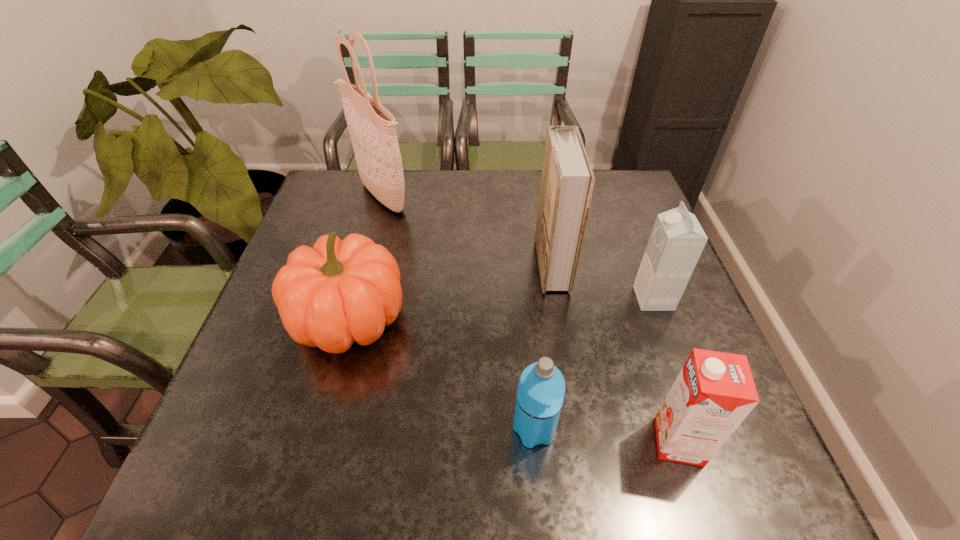
Find the location of a particular element. object that is the third nearest to the nearer carton is located at coordinates tap(567, 181).

Point out which object is positioned as the second nearest to the tallest object. Please provide its 2D coordinates. Your answer should be formatted as a tuple, i.e. [(x, y)], where the tuple contains the x and y coordinates of a point satisfying the conditions above.

[(567, 181)]

Find the location of a particular element. free point that satisfies the following two spatial constraints: 1. on the front side of the farthest object; 2. on the right side of the third object from left to right is located at coordinates (317, 429).